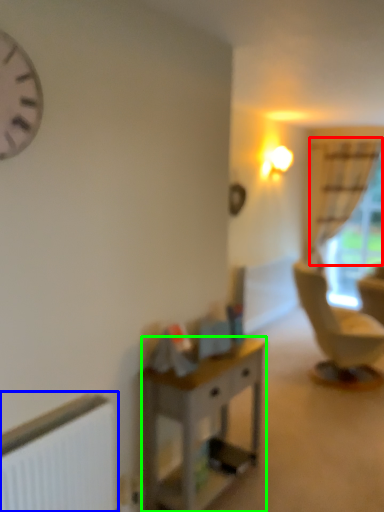
Question: Which is farther away from curtain (highlighted by a red box)? radiator (highlighted by a blue box) or desk (highlighted by a green box)?

Choices:
 (A) radiator
 (B) desk

Answer: (A)